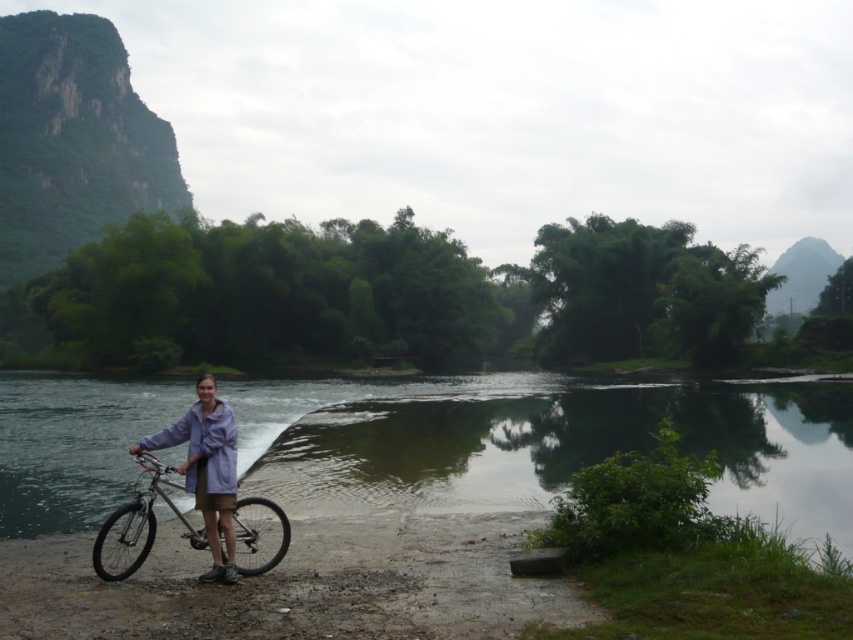
Is point (746, 445) farther from camera compared to point (231, 509)?

Yes, it is.

Does point (315, 387) lie in front of point (219, 513)?

That is False.

Where is `green reflective water at center`? green reflective water at center is located at coordinates (538, 442).

Does silver metallic bicycle at lower left appear over light purple fabric shirt at center?

Indeed, silver metallic bicycle at lower left is positioned over light purple fabric shirt at center.

Locate an element on the screen. silver metallic bicycle at lower left is located at coordinates [138, 525].

Does point (158, 477) come closer to viewer compared to point (207, 394)?

No, it is not.

Locate an element on the screen. This screenshot has width=853, height=640. silver metallic bicycle at lower left is located at coordinates (138, 525).

Does green reflective water at center have a lesser width compared to silver metallic bicycle at lower left?

No, green reflective water at center is not thinner than silver metallic bicycle at lower left.

Is point (718, 420) positioned after point (281, 518)?

That is True.

At what (x,y) coordinates should I click in order to perform the action: click on green reflective water at center. Please return your answer as a coordinate pair (x, y). The width and height of the screenshot is (853, 640). Looking at the image, I should click on (538, 442).